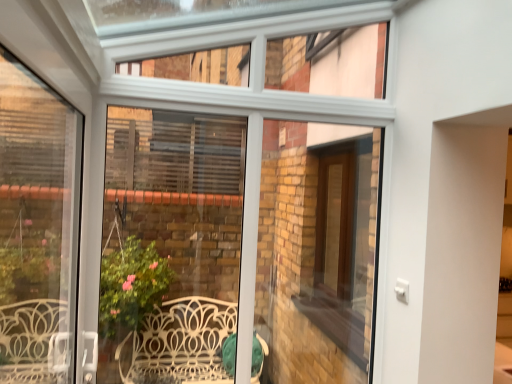
Measure the distance between white plastic window frame at left and camera.

white plastic window frame at left and camera are 3.17 meters apart from each other.

What do you see at coordinates (37, 227) in the screenshot?
I see `white plastic window frame at left` at bounding box center [37, 227].

Find the location of a particular element. This screenshot has height=384, width=512. white plastic window frame at left is located at coordinates [37, 227].

What do you see at coordinates (335, 224) in the screenshot? I see `brown wooden screen door at center` at bounding box center [335, 224].

The width and height of the screenshot is (512, 384). I want to click on brown wooden screen door at center, so click(335, 224).

Find the location of a particular element. The width and height of the screenshot is (512, 384). white plastic window frame at left is located at coordinates (37, 227).

Is brown wooden screen door at center to the right of white plastic window frame at left from the viewer's perspective?

Correct, you'll find brown wooden screen door at center to the right of white plastic window frame at left.

Does brown wooden screen door at center come behind white plastic window frame at left?

Yes, brown wooden screen door at center is further from the camera.

Considering the positions of point (339, 210) and point (17, 188), is point (339, 210) closer or farther from the camera than point (17, 188)?

Clearly, point (339, 210) is more distant from the camera than point (17, 188).

From the image's perspective, is brown wooden screen door at center located above or below white plastic window frame at left?

brown wooden screen door at center is below white plastic window frame at left.

From a real-world perspective, is brown wooden screen door at center physically above white plastic window frame at left?

Correct, in the physical world, brown wooden screen door at center is higher than white plastic window frame at left.

Is brown wooden screen door at center thinner than white plastic window frame at left?

Yes.

Considering the relative sizes of brown wooden screen door at center and white plastic window frame at left in the image provided, is brown wooden screen door at center taller than white plastic window frame at left?

Incorrect, the height of brown wooden screen door at center is not larger of that of white plastic window frame at left.

Considering the relative sizes of brown wooden screen door at center and white plastic window frame at left in the image provided, is brown wooden screen door at center bigger than white plastic window frame at left?

Actually, brown wooden screen door at center might be smaller than white plastic window frame at left.

Is brown wooden screen door at center not inside white plastic window frame at left?

brown wooden screen door at center lies outside white plastic window frame at left's area.

From the picture: Is the surface of brown wooden screen door at center in direct contact with white plastic window frame at left?

They are not placed beside each other.

Is brown wooden screen door at center aimed at white plastic window frame at left?

No, brown wooden screen door at center is not facing towards white plastic window frame at left.

What's the angular difference between brown wooden screen door at center and white plastic window frame at left's facing directions?

There is a 0.454-degree angle between the facing directions of brown wooden screen door at center and white plastic window frame at left.

The height and width of the screenshot is (384, 512). In order to click on screen door behind the white plastic window frame at left in this screenshot , I will do `click(335, 224)`.

Considering the relative positions of white plastic window frame at left and brown wooden screen door at center in the image provided, is white plastic window frame at left to the right of brown wooden screen door at center from the viewer's perspective?

No.

Does white plastic window frame at left lie in front of brown wooden screen door at center?

Yes, it is in front of brown wooden screen door at center.

Does point (39, 295) come in front of point (347, 290)?

That is False.

From the image's perspective, which is above, white plastic window frame at left or brown wooden screen door at center?

white plastic window frame at left is shown above in the image.

From a real-world perspective, is white plastic window frame at left over brown wooden screen door at center?

No.

Is white plastic window frame at left wider than brown wooden screen door at center?

Correct, the width of white plastic window frame at left exceeds that of brown wooden screen door at center.

Considering the relative sizes of white plastic window frame at left and brown wooden screen door at center in the image provided, is white plastic window frame at left taller than brown wooden screen door at center?

Yes, white plastic window frame at left is taller than brown wooden screen door at center.

Can you confirm if white plastic window frame at left is smaller than brown wooden screen door at center?

Actually, white plastic window frame at left might be larger than brown wooden screen door at center.

Is white plastic window frame at left situated inside brown wooden screen door at center or outside?

white plastic window frame at left is not inside brown wooden screen door at center, it's outside.

Are white plastic window frame at left and brown wooden screen door at center making contact?

white plastic window frame at left and brown wooden screen door at center are not in contact.

Looking at this image, is white plastic window frame at left positioned with its back to brown wooden screen door at center?

white plastic window frame at left does not have its back to brown wooden screen door at center.

Can you tell me how much white plastic window frame at left and brown wooden screen door at center differ in facing direction?

The facing directions of white plastic window frame at left and brown wooden screen door at center are 0.454 degrees apart.

Image resolution: width=512 pixels, height=384 pixels. What are the coordinates of `window frame that appears above the brown wooden screen door at center (from the image's perspective)` in the screenshot? It's located at (37, 227).

Find the location of a particular element. window frame in front of the brown wooden screen door at center is located at coordinates (37, 227).

The width and height of the screenshot is (512, 384). Identify the location of window frame below the brown wooden screen door at center (from a real-world perspective). (37, 227).